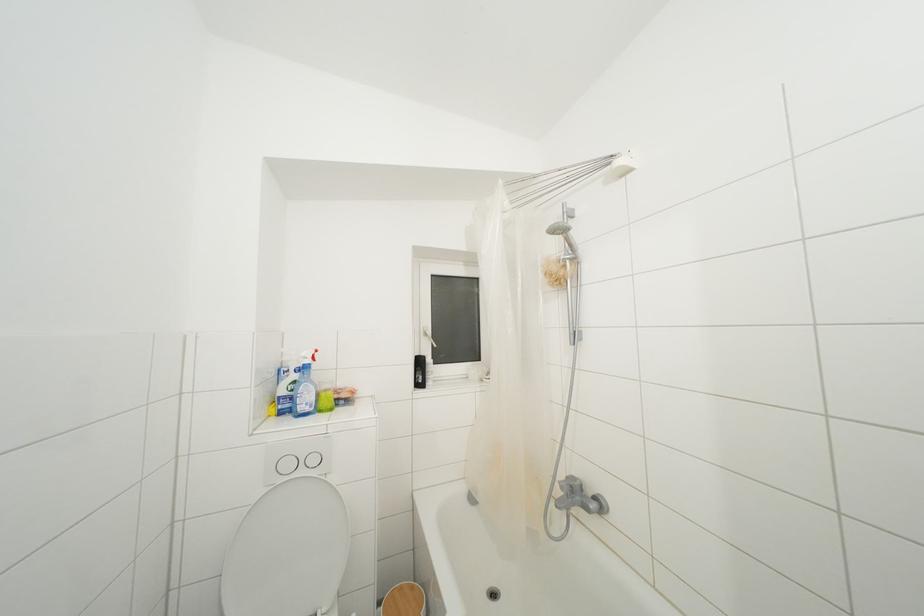
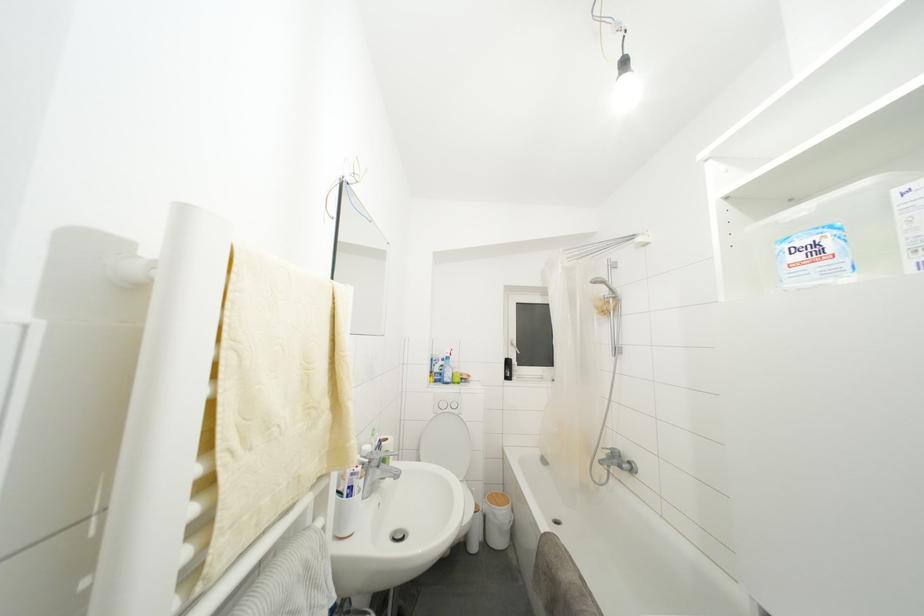
Question: The images are taken continuously from a first-person perspective. In which direction are you moving?

Choices:
 (A) Left
 (B) Right
 (C) Forward
 (D) Backward

Answer: (D)